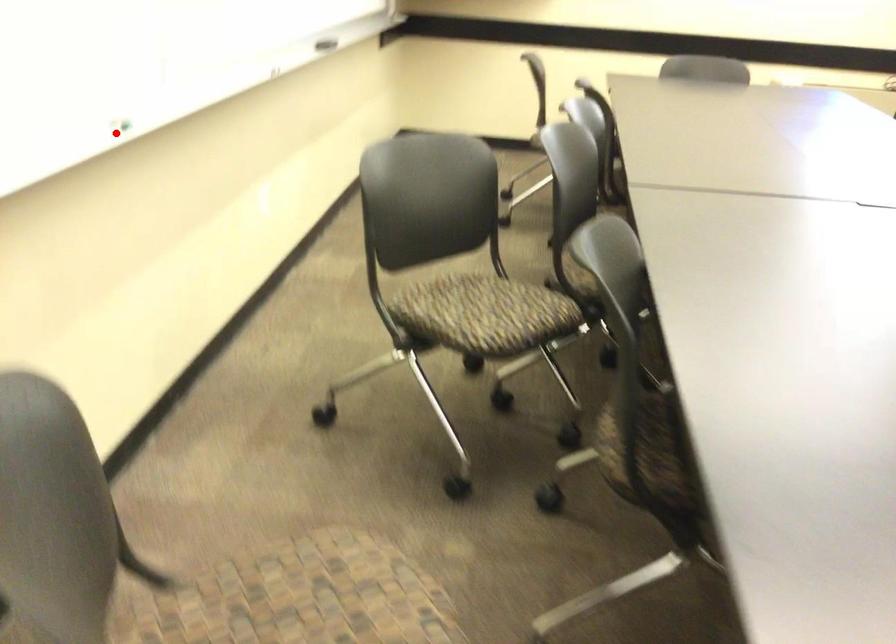
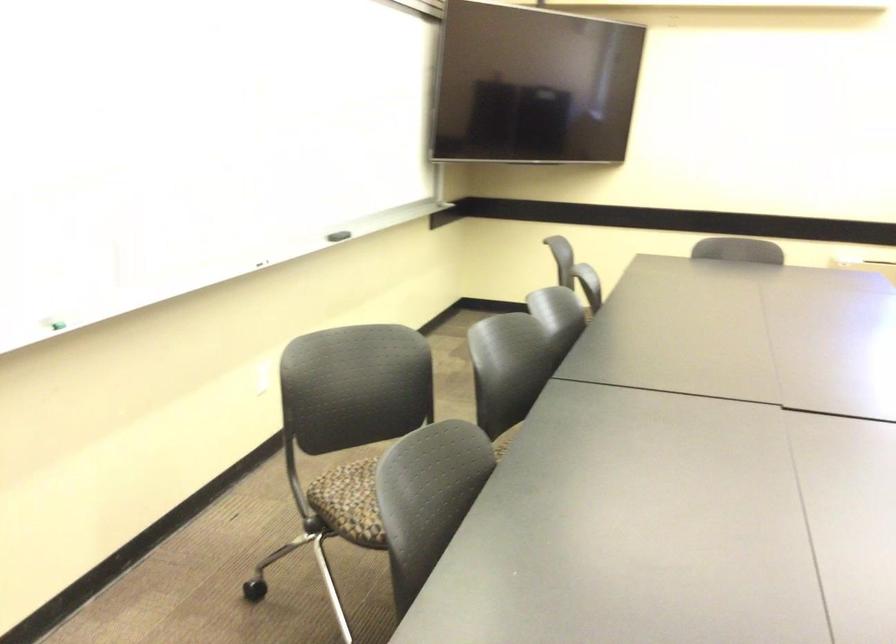
The point at the highlighted location is marked in the first image. Where is the corresponding point in the second image?

(55, 325)